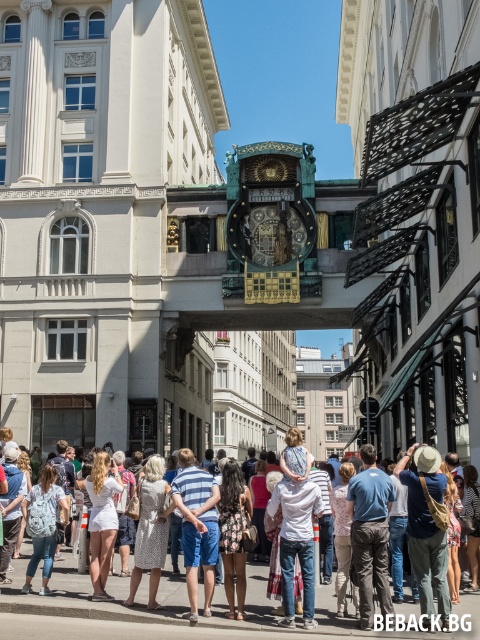
You are standing in front of the Ankeruhr clock in Vienna. You notice two points marked in the scene at coordinates point (108, 557) and point (49, 522). Which of these points is nearer to you?

Point (108, 557) is closer to the viewer than point (49, 522).

From the picture: You are standing in front of the Ankeruhr clock in Vienna and see a denim jacket at center and a white cotton shirt at center. Which clothing item is nearer to you?

The denim jacket at center is closer to the viewer than the white cotton shirt at center, so the denim jacket at center is nearer to you.

You are a tourist standing in front of the Ankeruhr clock in Vienna. You notice two people wearing a denim jacket at center and a brown printed dress at center. Which clothing item is closer to you?

The denim jacket at center is closer to you because it is in front of the brown printed dress at center.